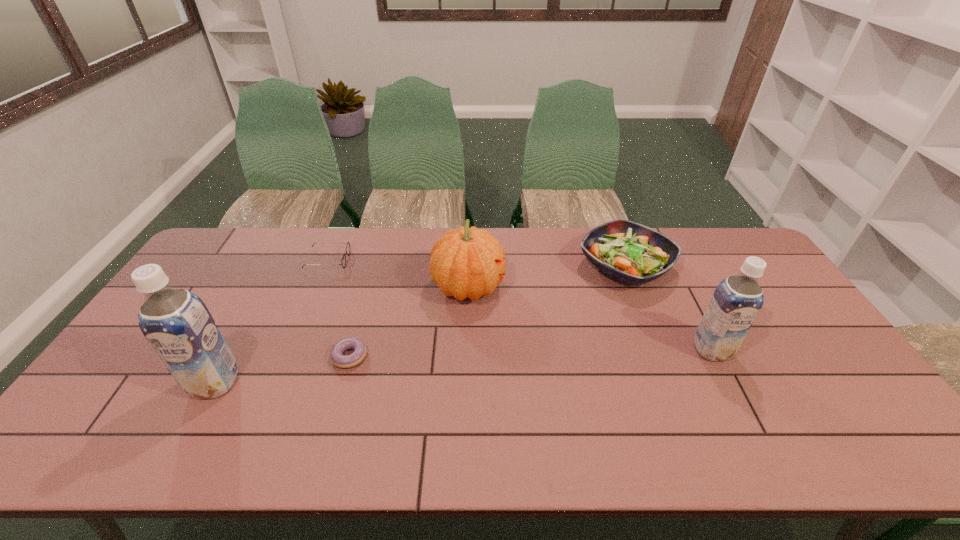
What are the coordinates of `blank area in the image that satisfies the following two spatial constraints: 1. on the front-facing side of the second shortest object; 2. on the label of the left soya milk` in the screenshot? It's located at (277, 382).